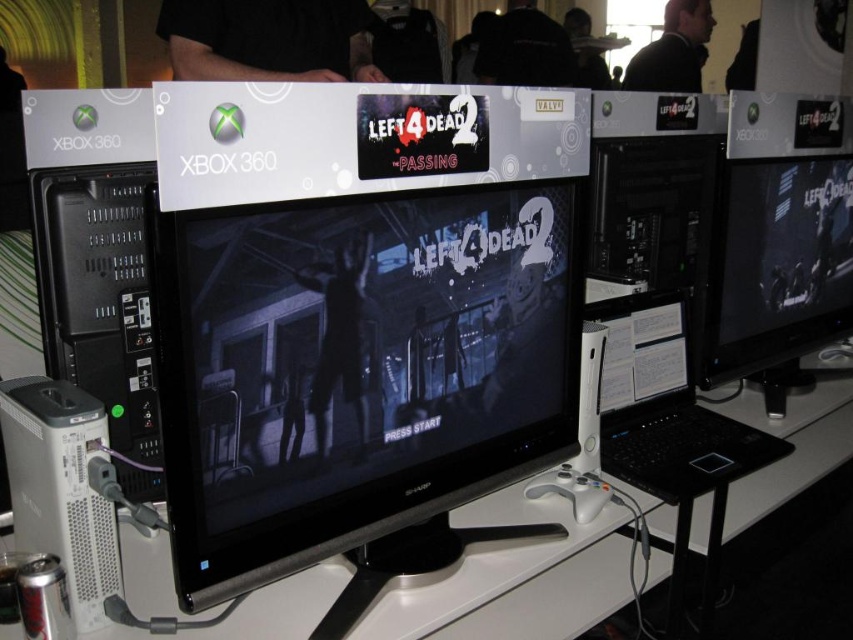
You are setting up a gaming booth and need to place the matte black monitor at center and the black matte laptop at center in a specific order. According to the layout, which device should be placed to the right of the other?

The matte black monitor at center is positioned on the right side of the black matte laptop at center, so the monitor should be placed to the right of the laptop.

You are setting up a display for a gaming event and need to place the matte black monitor at center and the black matte laptop at center. According to the setup, which device is placed above the other?

The matte black monitor at center is positioned over the black matte laptop at center, so the monitor is above the laptop.

You are setting up a gaming station and need to place the matte black monitor at center and the black plastic computer at left. The manufacturer recommends a minimum distance of 1.2 meters between the monitor and the computer for optimal cable management. Based on the image, will the current placement meet this requirement?

The distance between the matte black monitor at center and the black plastic computer at left is 1.32 meters, which exceeds the recommended minimum of 1.2 meters. Therefore, the current placement meets the requirement for optimal cable management.